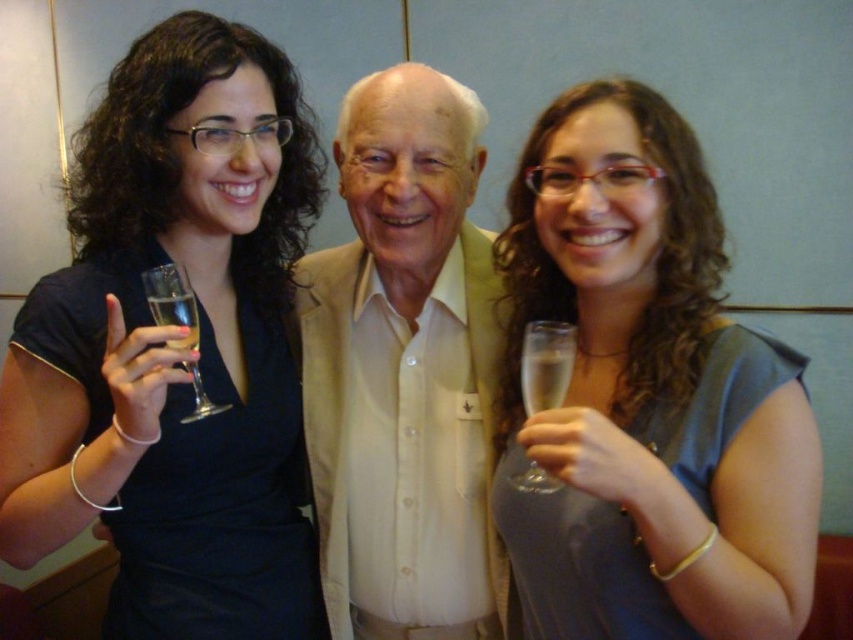
Question: Does matte black dress at center come behind matte gray dress at center?

Choices:
 (A) yes
 (B) no

Answer: (A)

Question: Where is matte black dress at center located in relation to light beige shirt at center in the image?

Choices:
 (A) right
 (B) left

Answer: (B)

Question: Is matte black dress at center bigger than clear glass wine glass at left?

Choices:
 (A) yes
 (B) no

Answer: (A)

Question: Which point appears farthest from the camera in this image?

Choices:
 (A) (720, 342)
 (B) (335, 484)

Answer: (B)

Question: Based on their relative distances, which object is nearer to the light beige shirt at center?

Choices:
 (A) matte gray dress at center
 (B) clear glass wine glass at right
 (C) matte black dress at center
 (D) clear glass wine glass at left

Answer: (C)

Question: Which is farther from the clear glass wine glass at right?

Choices:
 (A) matte black dress at center
 (B) matte gray dress at center

Answer: (A)